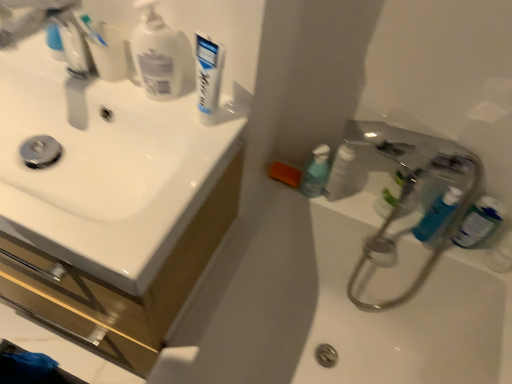
The width and height of the screenshot is (512, 384). Identify the location of free space between green translucent bottle at upper right, placed as the 2th mouthwash when sorted from right to left, and white glossy toothpaste tube at right, positioned as the third toiletry in right-to-left order. (x=357, y=200).